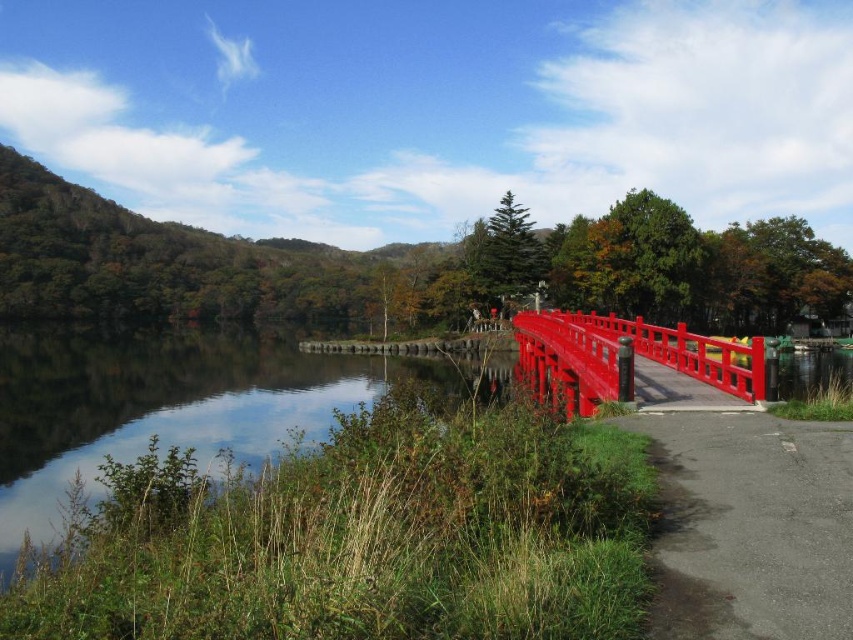
You are standing on the red bridge and want to take a photo of the clear water at center. Where should you point your camera to capture it?

You should point your camera towards the clear water at center located at point (167, 406) to capture it.

You are standing at the edge of the gray asphalt path at lower right and want to cross the water. Can you see the glossy wood bridge at center from your current position?

Yes, because the glossy wood bridge at center occupies more space in the image than the gray asphalt path at lower right, it is likely larger and more prominent, making it visible from the path.

You are standing at the edge of the gray asphalt path at lower right and want to cross to the clear water at center. Is there a direct path available without going around?

The gray asphalt path at lower right is behind clear water at center, so you cannot directly cross to the clear water at center from the gray asphalt path at lower right without going around.